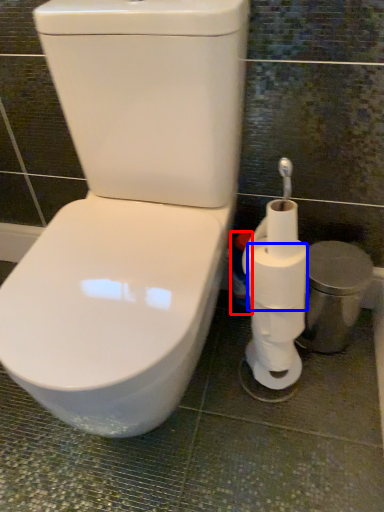
Question: Which object appears closest to the camera in this image, cleaning product (highlighted by a red box) or toilet paper (highlighted by a blue box)?

Choices:
 (A) cleaning product
 (B) toilet paper

Answer: (B)